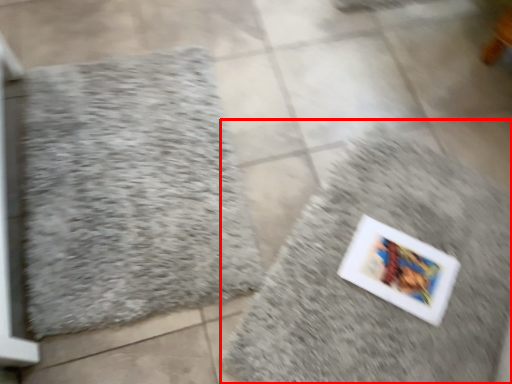
Question: From the image's perspective, considering the relative positions of bath mat (annotated by the red box) and bath mat in the image provided, where is bath mat (annotated by the red box) located with respect to the staircase?

Choices:
 (A) below
 (B) above

Answer: (A)